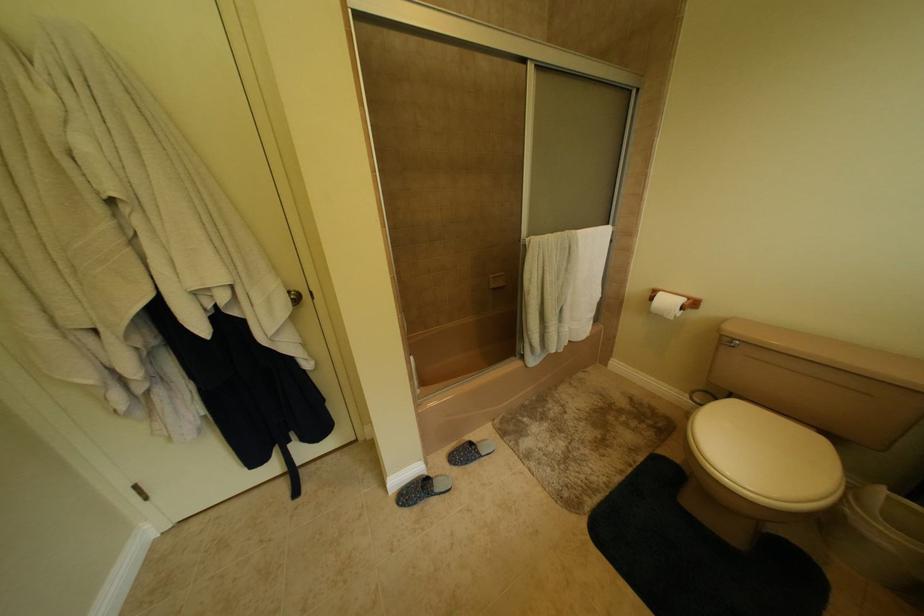
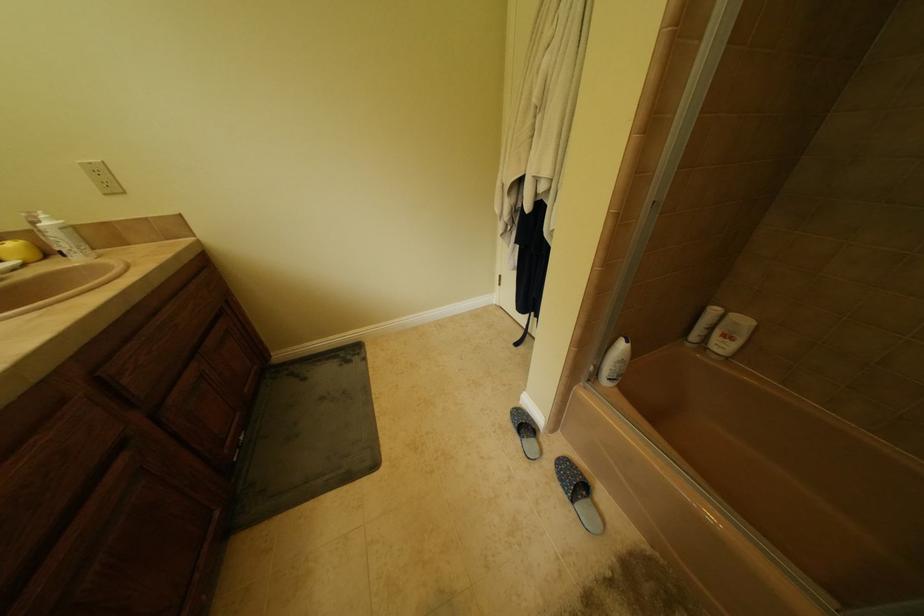
The images are taken continuously from a first-person perspective. In which direction is your viewpoint rotating?

The rotation direction of the camera is left-down.